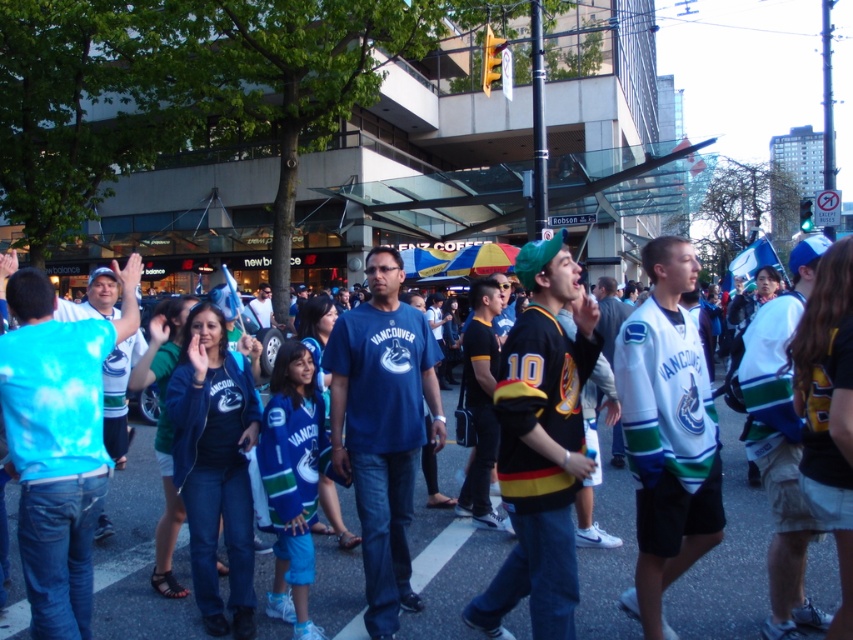
Does blue jersey at center have a lesser height compared to blue cotton t-shirt at center?

Yes.

Between point (763, 572) and point (379, 524), which one is positioned behind?

Positioned behind is point (763, 572).

The height and width of the screenshot is (640, 853). I want to click on blue jersey at center, so click(x=727, y=557).